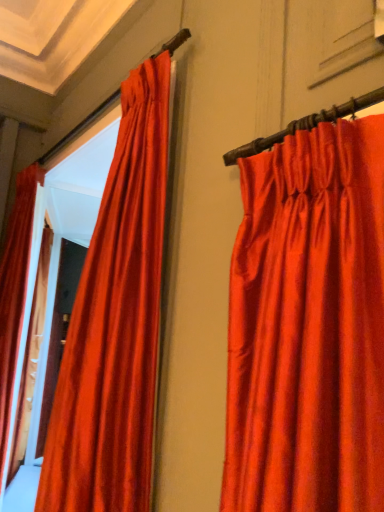
This screenshot has height=512, width=384. What do you see at coordinates (115, 323) in the screenshot?
I see `satin red curtain at center, positioned as the 2th curtain in back-to-front order` at bounding box center [115, 323].

This screenshot has width=384, height=512. Find the location of `satin red curtain at center, which ranks as the first curtain in front-to-back order`. satin red curtain at center, which ranks as the first curtain in front-to-back order is located at coordinates (x=115, y=323).

In order to face satin red curtain at center, which ranks as the first curtain in front-to-back order, should I rotate leftwards or rightwards?

You should rotate left by 11.571 degrees.

At what (x,y) coordinates should I click in order to perform the action: click on satin red curtain at left, arranged as the second curtain when viewed from the front. Please return your answer as a coordinate pair (x, y). Looking at the image, I should click on (15, 294).

What do you see at coordinates (15, 294) in the screenshot? The image size is (384, 512). I see `satin red curtain at left, arranged as the second curtain when viewed from the front` at bounding box center [15, 294].

Locate an element on the screen. satin red curtain at center, which ranks as the first curtain in front-to-back order is located at coordinates (115, 323).

Is satin red curtain at left, acting as the second curtain starting from the right, to the right of satin red curtain at center, which is the second curtain in left-to-right order, from the viewer's perspective?

Incorrect, satin red curtain at left, acting as the second curtain starting from the right, is not on the right side of satin red curtain at center, which is the second curtain in left-to-right order.

Does satin red curtain at left, acting as the second curtain starting from the right, come in front of satin red curtain at center, which ranks as the first curtain in front-to-back order?

No, the depth of satin red curtain at left, acting as the second curtain starting from the right, is greater than that of satin red curtain at center, which ranks as the first curtain in front-to-back order.

Is point (10, 244) positioned after point (127, 367)?

Yes, it is behind point (127, 367).

From the image's perspective, which is above, satin red curtain at left, the first curtain positioned from the left, or satin red curtain at center, which ranks as the first curtain in front-to-back order?

satin red curtain at center, which ranks as the first curtain in front-to-back order, is shown above in the image.

From a real-world perspective, is satin red curtain at left, the first curtain positioned from the left, on top of satin red curtain at center, the first curtain viewed from the right?

No, from a real-world perspective, satin red curtain at left, the first curtain positioned from the left, is not over satin red curtain at center, the first curtain viewed from the right

Is satin red curtain at left, acting as the second curtain starting from the right, thinner than satin red curtain at center, which ranks as the first curtain in front-to-back order?

Yes.

Does satin red curtain at left, marked as the first curtain in a back-to-front arrangement, have a lesser height compared to satin red curtain at center, which is the second curtain in left-to-right order?

No.

In terms of size, does satin red curtain at left, arranged as the second curtain when viewed from the front, appear bigger or smaller than satin red curtain at center, which is the second curtain in left-to-right order?

Clearly, satin red curtain at left, arranged as the second curtain when viewed from the front, is larger in size than satin red curtain at center, which is the second curtain in left-to-right order.

Do you think satin red curtain at left, marked as the first curtain in a back-to-front arrangement, is within satin red curtain at center, which ranks as the first curtain in front-to-back order, or outside of it?

satin red curtain at left, marked as the first curtain in a back-to-front arrangement, is not inside satin red curtain at center, which ranks as the first curtain in front-to-back order, it's outside.

Consider the image. Would you say satin red curtain at left, acting as the second curtain starting from the right, is a long distance from satin red curtain at center, which ranks as the first curtain in front-to-back order?

satin red curtain at left, acting as the second curtain starting from the right, is positioned a significant distance from satin red curtain at center, which ranks as the first curtain in front-to-back order.

Is satin red curtain at left, acting as the second curtain starting from the right, oriented towards satin red curtain at center, which is the second curtain in left-to-right order?

No, satin red curtain at left, acting as the second curtain starting from the right, is not oriented towards satin red curtain at center, which is the second curtain in left-to-right order.

Image resolution: width=384 pixels, height=512 pixels. I want to click on curtain above the satin red curtain at left, the first curtain positioned from the left (from a real-world perspective), so click(115, 323).

Is satin red curtain at center, positioned as the 2th curtain in back-to-front order, at the left side of satin red curtain at left, acting as the second curtain starting from the right?

No.

Is satin red curtain at center, the first curtain viewed from the right, positioned in front of satin red curtain at left, marked as the first curtain in a back-to-front arrangement?

Yes, it is in front of satin red curtain at left, marked as the first curtain in a back-to-front arrangement.

Is point (77, 343) behind point (16, 311)?

That is False.

From the image's perspective, is satin red curtain at center, which ranks as the first curtain in front-to-back order, below satin red curtain at left, acting as the second curtain starting from the right?

No, from the image's perspective, satin red curtain at center, which ranks as the first curtain in front-to-back order, is not below satin red curtain at left, acting as the second curtain starting from the right.

From a real-world perspective, is satin red curtain at center, positioned as the 2th curtain in back-to-front order, beneath satin red curtain at left, marked as the first curtain in a back-to-front arrangement?

Actually, satin red curtain at center, positioned as the 2th curtain in back-to-front order, is physically above satin red curtain at left, marked as the first curtain in a back-to-front arrangement, in the real world.

Between satin red curtain at center, the first curtain viewed from the right, and satin red curtain at left, marked as the first curtain in a back-to-front arrangement, which one has smaller width?

satin red curtain at left, marked as the first curtain in a back-to-front arrangement, is thinner.

Based on the photo, considering the relative sizes of satin red curtain at center, positioned as the 2th curtain in back-to-front order, and satin red curtain at left, the first curtain positioned from the left, in the image provided, is satin red curtain at center, positioned as the 2th curtain in back-to-front order, shorter than satin red curtain at left, the first curtain positioned from the left,?

Correct, satin red curtain at center, positioned as the 2th curtain in back-to-front order, is not as tall as satin red curtain at left, the first curtain positioned from the left.

Between satin red curtain at center, which is the second curtain in left-to-right order, and satin red curtain at left, marked as the first curtain in a back-to-front arrangement, which one has larger size?

With larger size is satin red curtain at left, marked as the first curtain in a back-to-front arrangement.

Can we say satin red curtain at center, the first curtain viewed from the right, lies outside satin red curtain at left, the first curtain positioned from the left?

Absolutely, satin red curtain at center, the first curtain viewed from the right, is external to satin red curtain at left, the first curtain positioned from the left.

Is satin red curtain at center, the first curtain viewed from the right, next to satin red curtain at left, arranged as the second curtain when viewed from the front?

No, satin red curtain at center, the first curtain viewed from the right, is not in contact with satin red curtain at left, arranged as the second curtain when viewed from the front.

Is satin red curtain at left, marked as the first curtain in a back-to-front arrangement, at the back of satin red curtain at center, which is the second curtain in left-to-right order?

No.

How different are the orientations of satin red curtain at center, the first curtain viewed from the right, and satin red curtain at left, arranged as the second curtain when viewed from the front, in degrees?

The angular difference between satin red curtain at center, the first curtain viewed from the right, and satin red curtain at left, arranged as the second curtain when viewed from the front, is 0.00225 degrees.

Locate an element on the screen. curtain on the left of the satin red curtain at center, which is the second curtain in left-to-right order is located at coordinates (15, 294).

Identify the location of curtain below the satin red curtain at center, positioned as the 2th curtain in back-to-front order (from the image's perspective). (15, 294).

I want to click on curtain above the satin red curtain at left, marked as the first curtain in a back-to-front arrangement (from the image's perspective), so (115, 323).